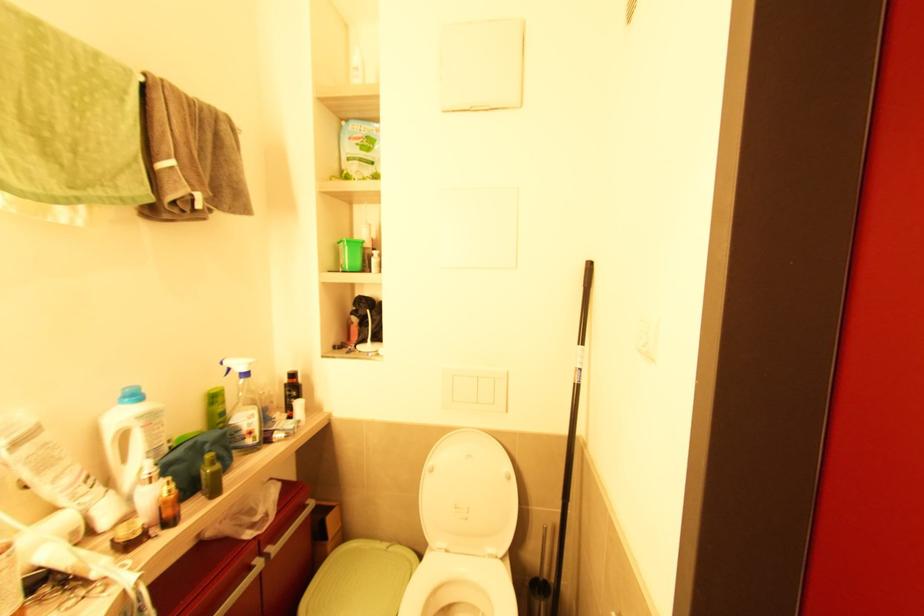
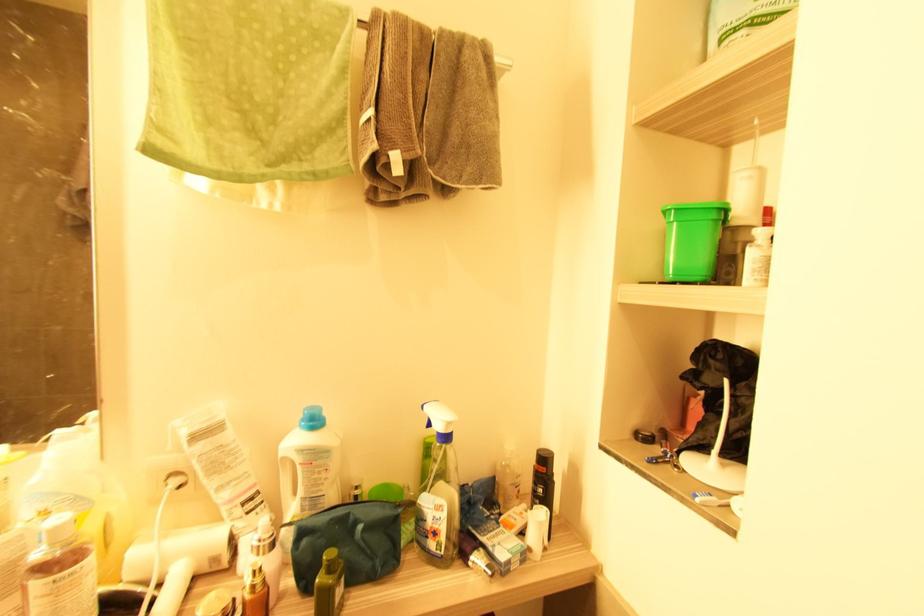
Where in the second image is the point corresponding to point 249,375 from the first image?

(447, 438)